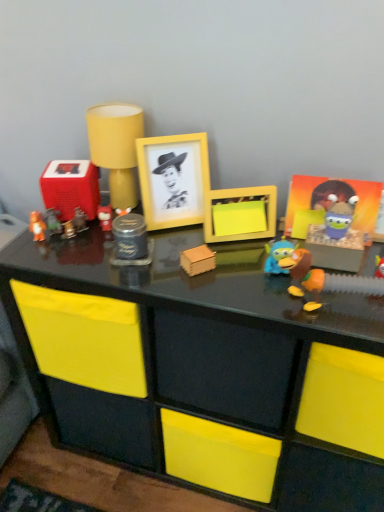
At what (x,y) coordinates should I click in order to perform the action: click on free space to the left of wooden block at center, positioned as the ninth toy in left-to-right order. Please return your answer as a coordinate pair (x, y). Looking at the image, I should click on (139, 276).